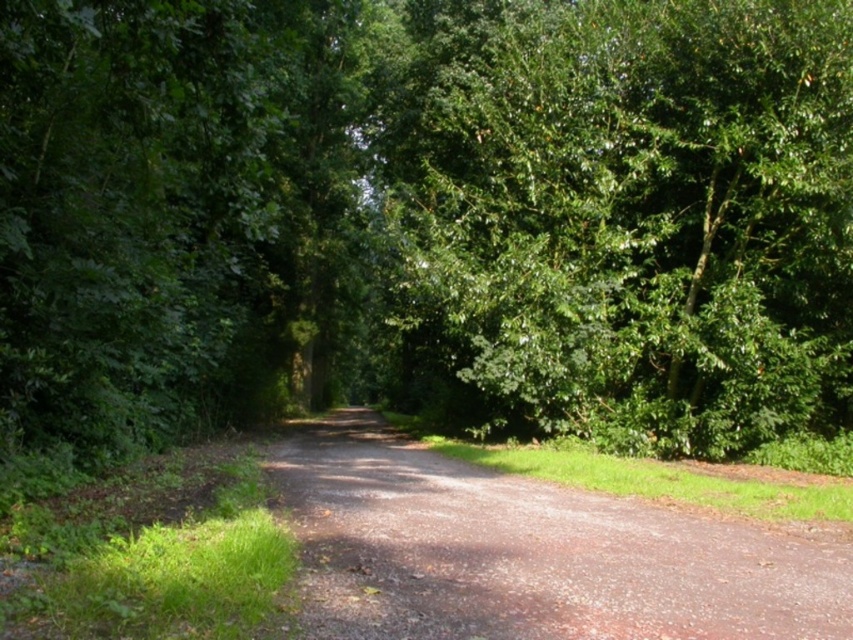
You are standing at the starting point of the dirt path and want to reach the green leafy tree at center. According to the coordinates provided, in which direction should you walk to reach it?

The green leafy tree at center is located at coordinates point (636, 227), so you should walk forward along the dirt path towards the center to reach it.